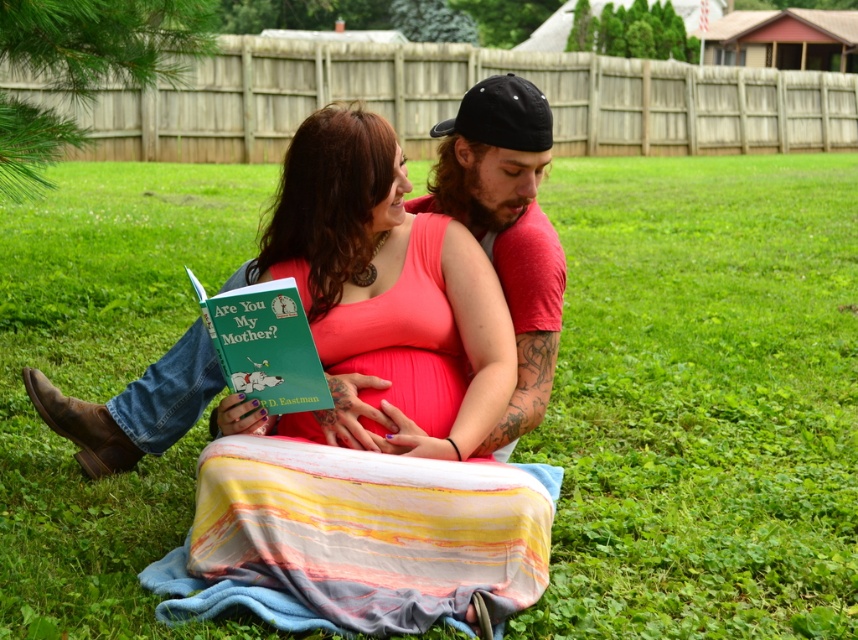
Question: Considering the relative positions of pink fabric at center and striped cotton blanket at center in the image provided, where is pink fabric at center located with respect to striped cotton blanket at center?

Choices:
 (A) right
 (B) left

Answer: (B)

Question: Which object is the closest to the green matte book at center?

Choices:
 (A) matte black cap at upper center
 (B) striped cotton blanket at center
 (C) smooth pink skin at center
 (D) pink fabric at center

Answer: (D)

Question: Which object is the farthest from the smooth pink skin at center?

Choices:
 (A) pink fabric at center
 (B) striped cotton blanket at center
 (C) matte black cap at upper center

Answer: (C)

Question: Which of the following is the closest to the observer?

Choices:
 (A) green matte book at center
 (B) striped cotton blanket at center

Answer: (B)

Question: Is pink fabric at center above matte black cap at upper center?

Choices:
 (A) no
 (B) yes

Answer: (A)

Question: Does pink fabric at center appear under green matte book at center?

Choices:
 (A) yes
 (B) no

Answer: (B)